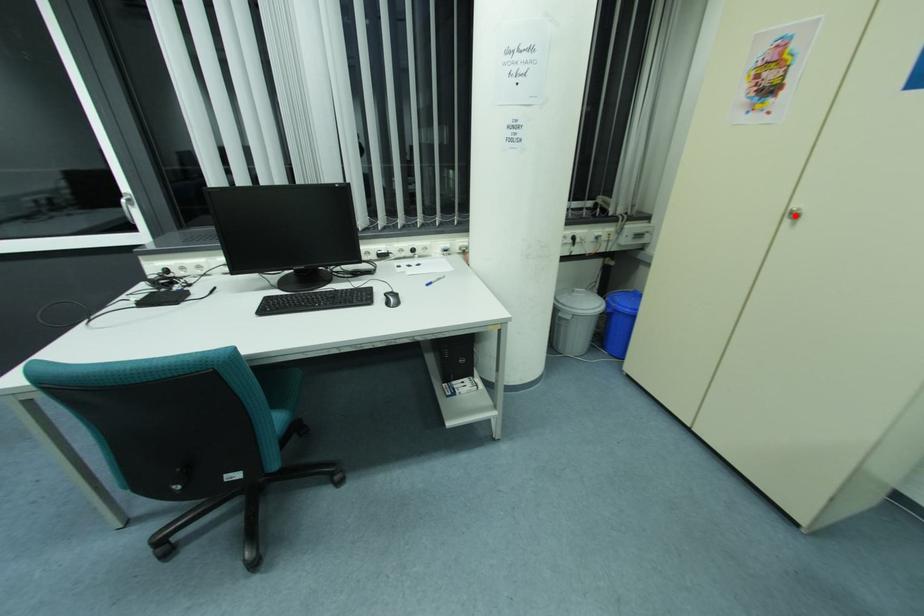
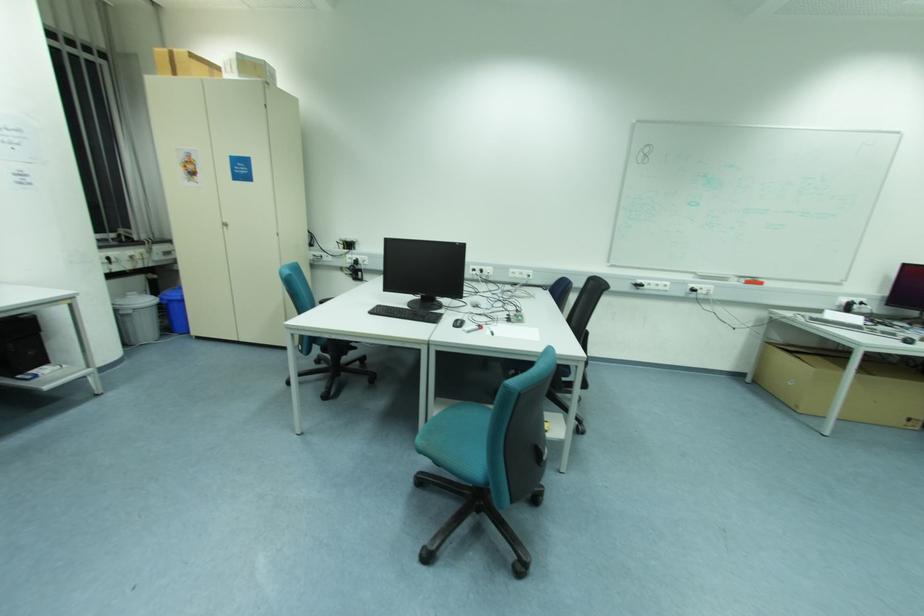
Find the pixel in the second image that matches the highlighted location in the first image.

(226, 225)